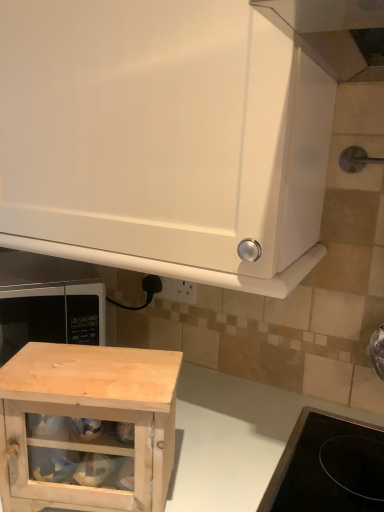
Question: From a real-world perspective, relative to white plastic electric outlet at lower center, is white glossy cabinet at upper center, the first cabinetry from the top, vertically above or below?

Choices:
 (A) above
 (B) below

Answer: (A)

Question: Considering the positions of white glossy cabinet at upper center, the first cabinetry from the top, and white plastic electric outlet at lower center in the image, is white glossy cabinet at upper center, the first cabinetry from the top, wider or thinner than white plastic electric outlet at lower center?

Choices:
 (A) wide
 (B) thin

Answer: (A)

Question: Which object is the farthest from the white plastic electric outlet at lower center?

Choices:
 (A) black matte microwave at lower left
 (B) white glossy cabinet at upper center, the first cabinetry from the top
 (C) natural wood cabinet at lower center
 (D) natural wood cabinet at lower left, which is counted as the first cabinetry, starting from the bottom

Answer: (D)

Question: Estimate the real-world distances between objects in this image. Which object is closer to the natural wood cabinet at lower left, which is counted as the first cabinetry, starting from the bottom?

Choices:
 (A) black matte microwave at lower left
 (B) natural wood cabinet at lower center
 (C) white glossy cabinet at upper center, the first cabinetry from the top
 (D) white plastic electric outlet at lower center

Answer: (B)